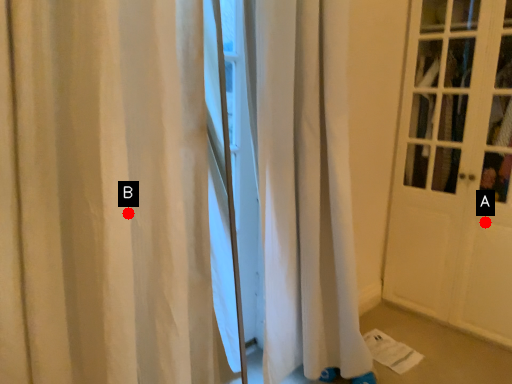
Question: Two points are circled on the image, labeled by A and B beside each circle. Which point is closer to the camera taking this photo?

Choices:
 (A) A is closer
 (B) B is closer

Answer: (B)